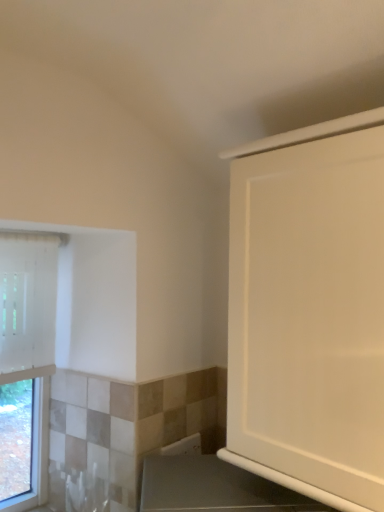
Question: Looking at the image, does white fabric window at left seem bigger or smaller compared to white glossy cabinet at upper right?

Choices:
 (A) big
 (B) small

Answer: (B)

Question: From the image's perspective, is white fabric window at left positioned above or below white glossy cabinet at upper right?

Choices:
 (A) below
 (B) above

Answer: (A)

Question: Is white fabric window at left to the left or to the right of white glossy cabinet at upper right in the image?

Choices:
 (A) right
 (B) left

Answer: (B)

Question: From a real-world perspective, is white glossy cabinet at upper right above or below white fabric window at left?

Choices:
 (A) above
 (B) below

Answer: (A)

Question: Would you say white glossy cabinet at upper right is inside or outside white fabric window at left?

Choices:
 (A) outside
 (B) inside

Answer: (A)

Question: Is white glossy cabinet at upper right taller or shorter than white fabric window at left?

Choices:
 (A) short
 (B) tall

Answer: (A)

Question: In the image, is white glossy cabinet at upper right positioned in front of or behind white fabric window at left?

Choices:
 (A) front
 (B) behind

Answer: (A)